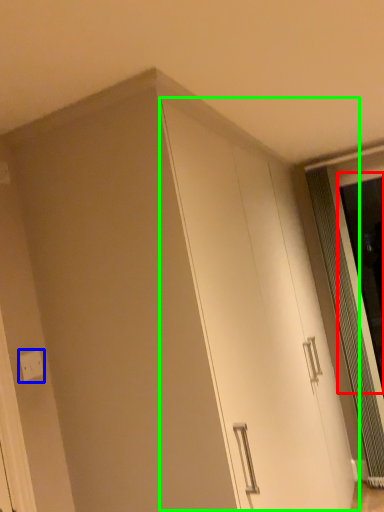
Question: Which object is the farthest from screen door (highlighted by a red box)? Choose among these: electric outlet (highlighted by a blue box) or cabinetry (highlighted by a green box).

Choices:
 (A) electric outlet
 (B) cabinetry

Answer: (A)